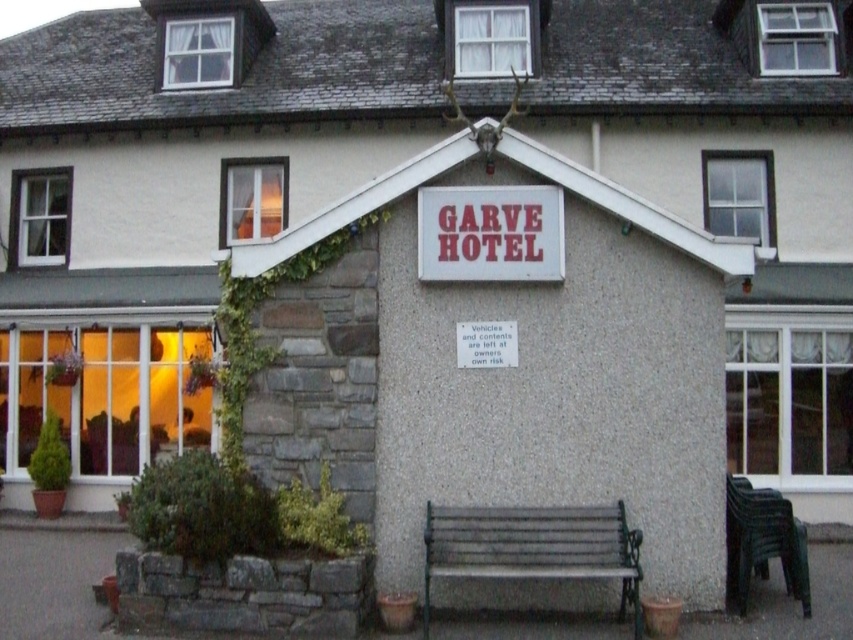
You are a guest arriving at the Garve Hotel and see the green metal bench at lower center and the red plastic sign at center. According to the scene, which object is positioned to the right of the other?

The green metal bench at lower center is to the right of the red plastic sign at center.

You are a guest arriving at the Garve Hotel and need to find the reception desk. You see the red plastic sign at center and the black plastic bench at lower right. Which object is wider?

The red plastic sign at center is wider than the black plastic bench at lower right.

You are a guest arriving at the Garve Hotel and see the red plastic sign at center and the black plastic bench at lower right. Which object is smaller in size?

The red plastic sign at center is smaller in size compared to the black plastic bench at lower right.